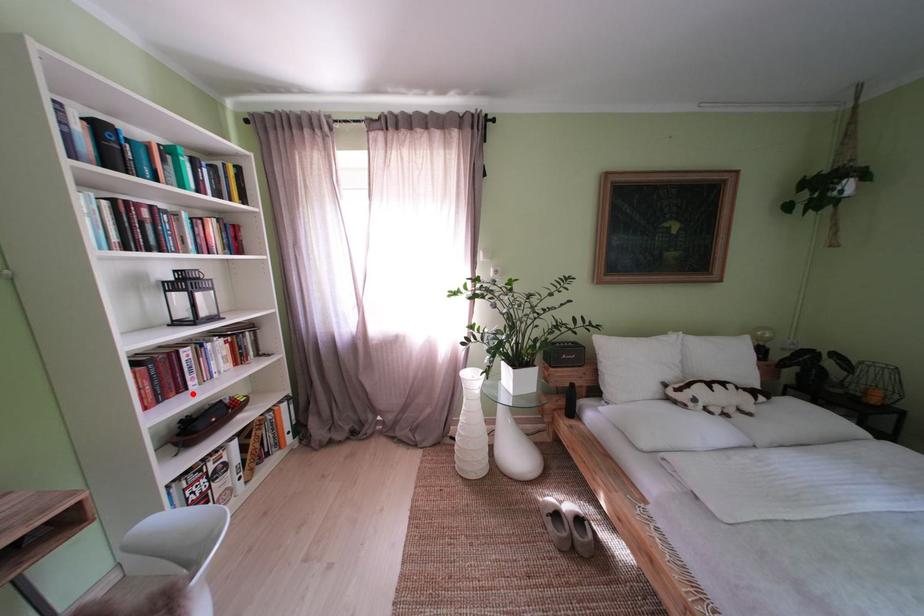
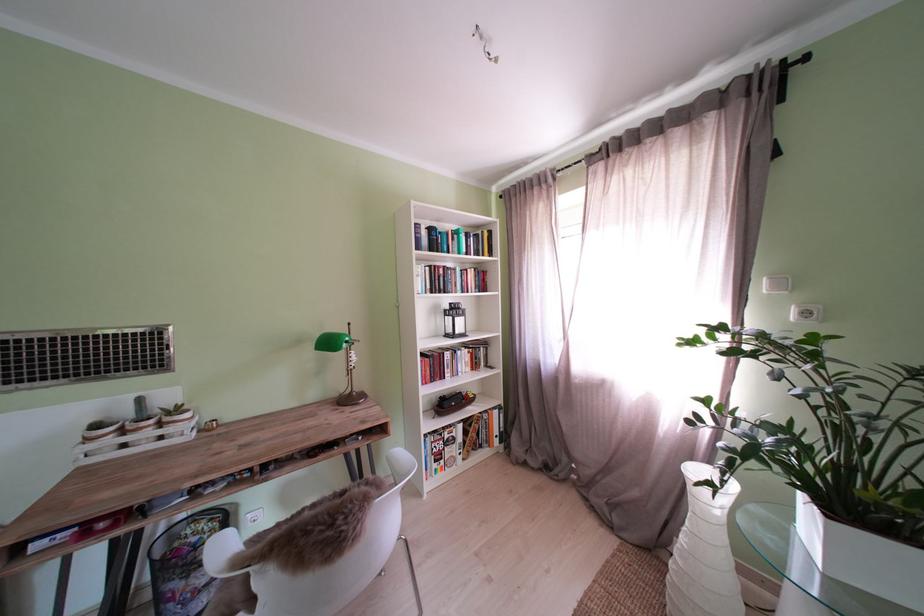
In the second image, find the point that corresponds to the highlighted location in the first image.

(454, 382)